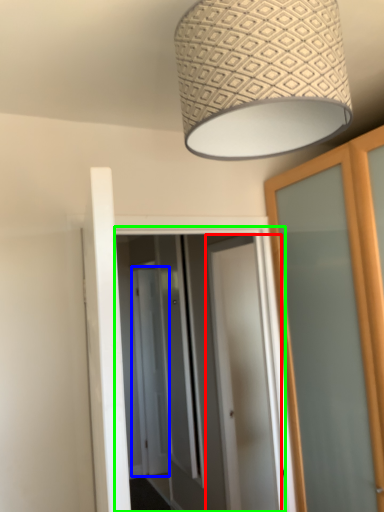
Question: Which is farther away from door (highlighted by a red box)? screen door (highlighted by a blue box) or screen door (highlighted by a green box)?

Choices:
 (A) screen door
 (B) screen door

Answer: (A)